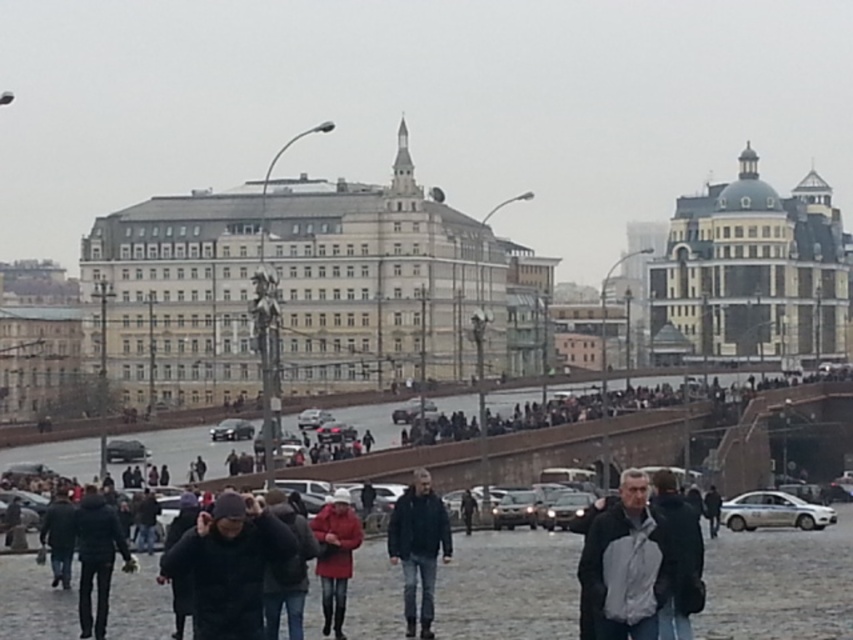
Question: Which of these objects is positioned farthest from the gray fabric jacket at center?

Choices:
 (A) dark blue jacket at center
 (B) matte red coat at center
 (C) dark gray jacket at lower left
 (D) dark gray knit cap at center

Answer: (C)

Question: Does gray fabric jacket at center have a greater width compared to dark blue jacket at center?

Choices:
 (A) yes
 (B) no

Answer: (A)

Question: Does dark blue jacket at center appear on the left side of matte red coat at center?

Choices:
 (A) yes
 (B) no

Answer: (B)

Question: Estimate the real-world distances between objects in this image. Which object is farther from the dark blue jacket at center?

Choices:
 (A) matte red coat at center
 (B) gray fabric jacket at center
 (C) dark gray knit cap at center
 (D) dark gray jacket at lower left

Answer: (D)

Question: Which point is farther to the camera?

Choices:
 (A) (663, 598)
 (B) (387, 544)
 (C) (352, 547)

Answer: (B)

Question: Is gray fabric jacket at center above matte red coat at center?

Choices:
 (A) yes
 (B) no

Answer: (A)